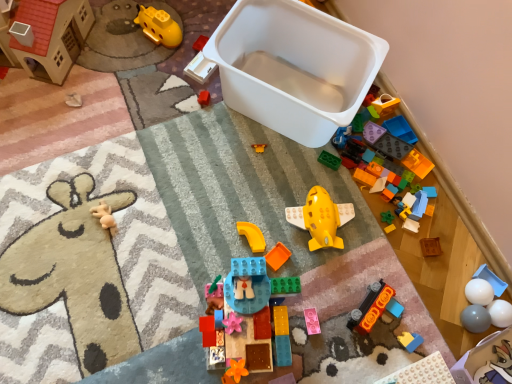
Where is `space that is in front of orange matte car at lower right, the 8th toy in the right-to-left sequence`? space that is in front of orange matte car at lower right, the 8th toy in the right-to-left sequence is located at coordinates (354, 354).